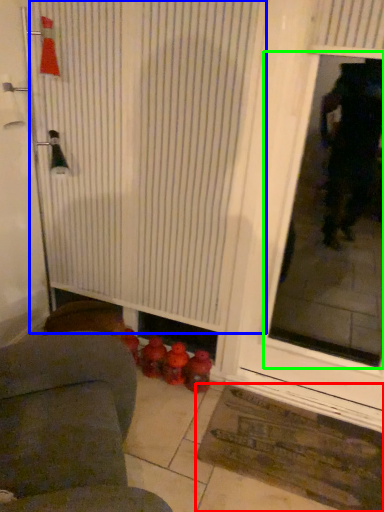
Question: Which object is positioned closest to doormat (highlighted by a red box)? Select from shower curtain (highlighted by a blue box) and window screen (highlighted by a green box).

Choices:
 (A) shower curtain
 (B) window screen

Answer: (A)